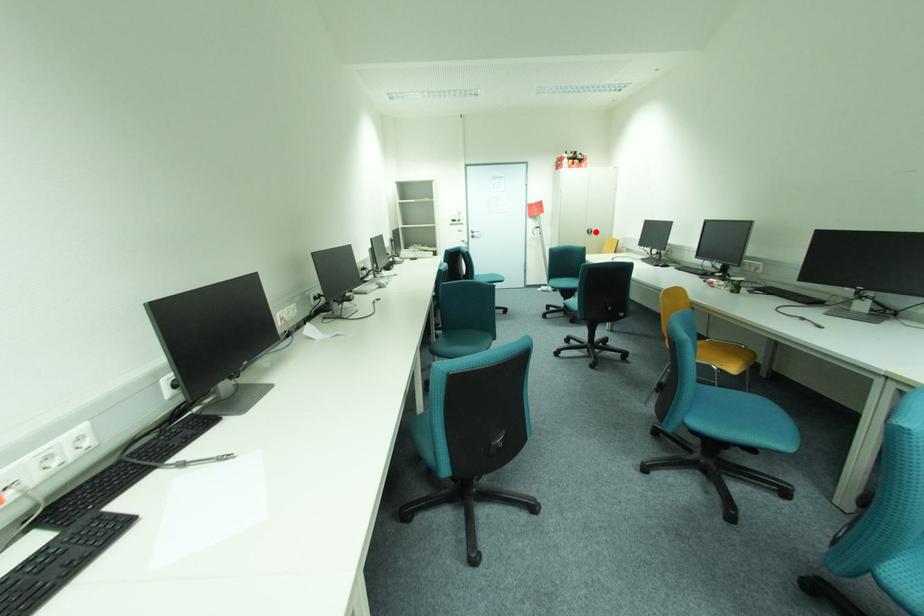
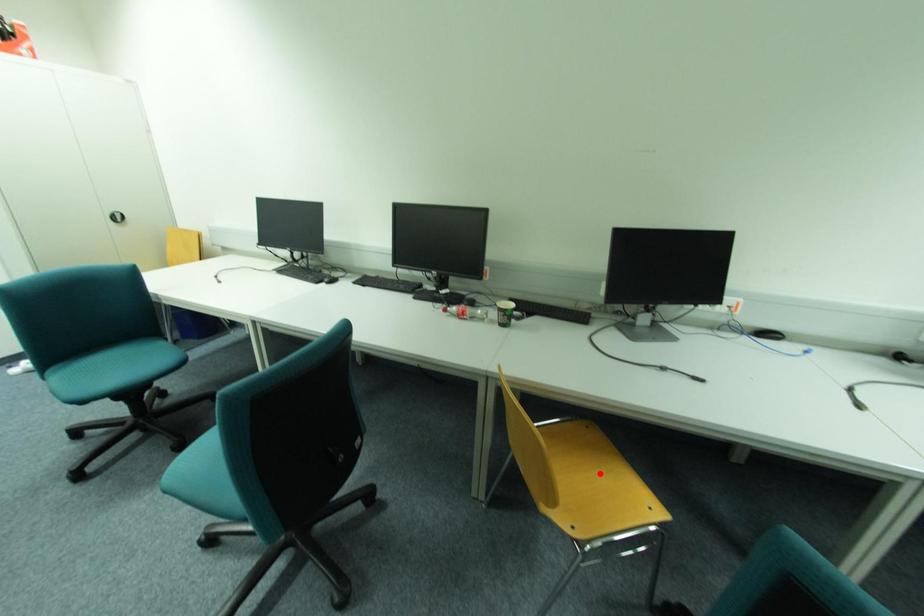
I am providing you with two images of the same scene from different viewpoints. A red point is marked on the first image and another point is marked on the second image. Is the red point in image1 aligned with the point shown in image2?

No